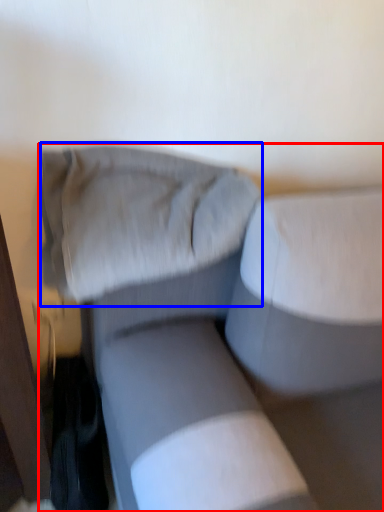
Question: Which point is further to the camera, studio couch (highlighted by a red box) or pillow (highlighted by a blue box)?

Choices:
 (A) studio couch
 (B) pillow

Answer: (B)